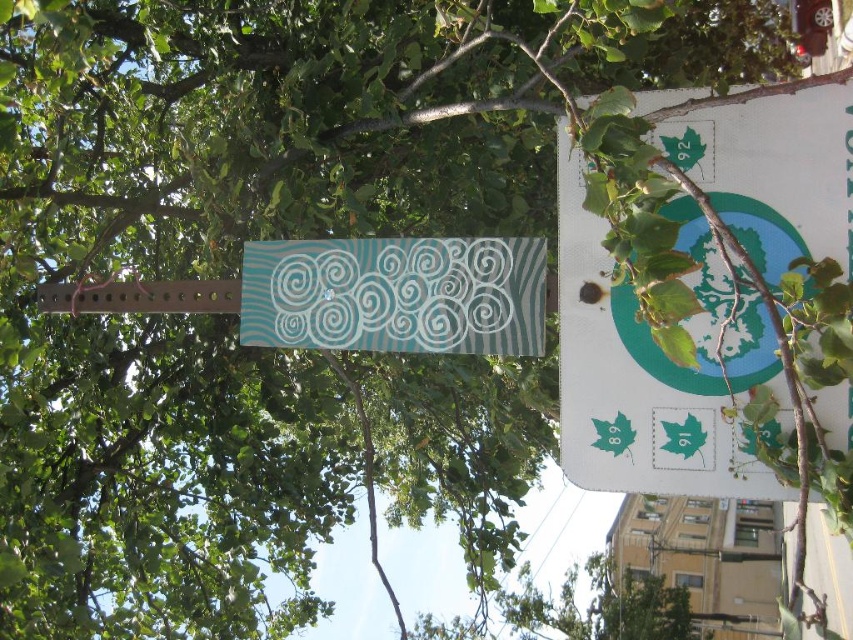
Can you confirm if white paper sign at upper right is taller than teal matte sign at center?

Yes, white paper sign at upper right is taller than teal matte sign at center.

Is white paper sign at upper right positioned behind teal matte sign at center?

No, it is not.

Is point (595, 451) positioned in front of point (413, 300)?

Yes, point (595, 451) is closer to viewer.

Identify the location of white paper sign at upper right. The height and width of the screenshot is (640, 853). (654, 365).